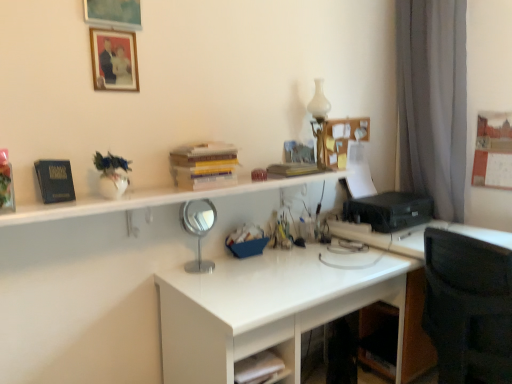
Find the location of a particular element. The width and height of the screenshot is (512, 384). free space to the right of polished silver mirror at center is located at coordinates (233, 272).